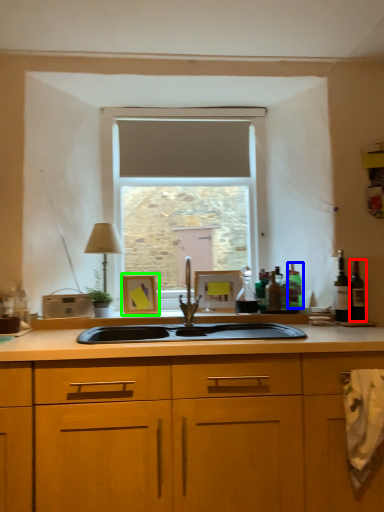
Question: Considering the real-world distances, which object is farthest from wine bottle (highlighted by a red box)? bottle (highlighted by a blue box) or picture frame (highlighted by a green box)?

Choices:
 (A) bottle
 (B) picture frame

Answer: (B)